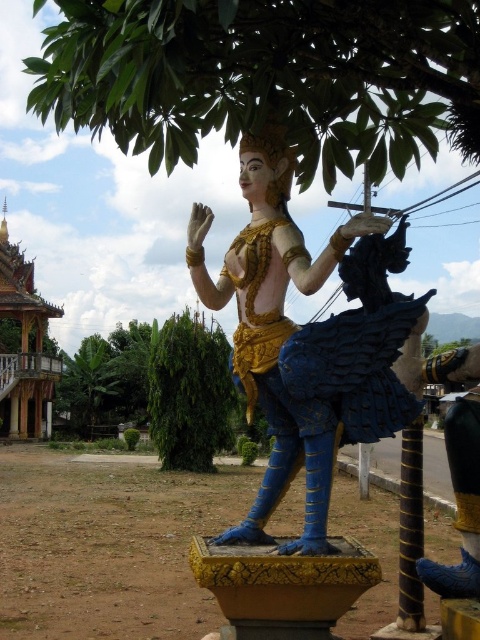
You are standing in the courtyard and want to take a photo of both the gold textured statue at center and the green leafy tree at center. Which object should you focus on first to ensure both are in the frame?

You should focus on the gold textured statue at center first because it is closer to you than the green leafy tree at center, so adjusting the focus to include the closer statue will naturally include the tree in the background.

You are standing in the courtyard and want to find the taller tree to rest under. Which tree should you choose between the green leafy tree at upper center and the green leafy tree at lower left?

The green leafy tree at lower left is taller than the green leafy tree at upper center, so you should choose the green leafy tree at lower left to rest under.